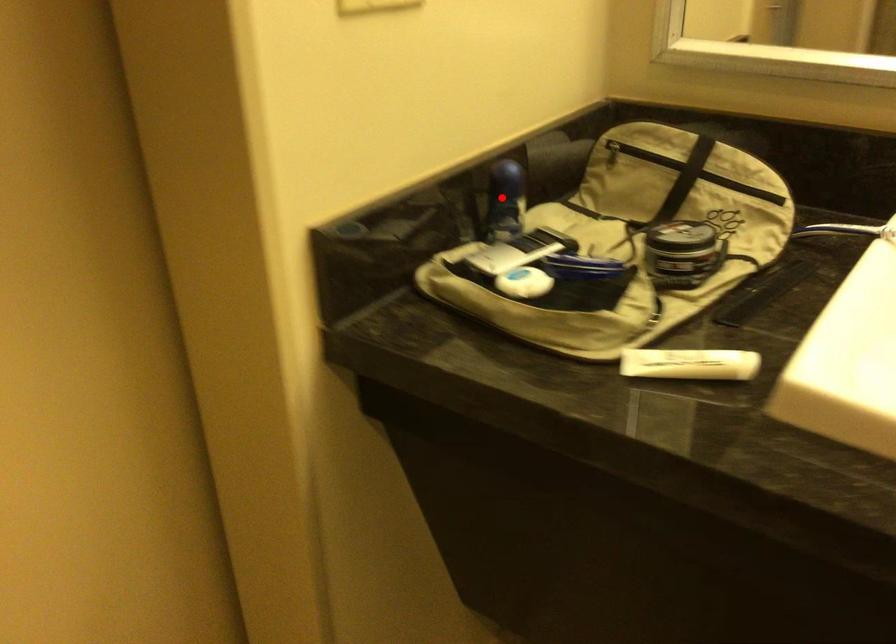
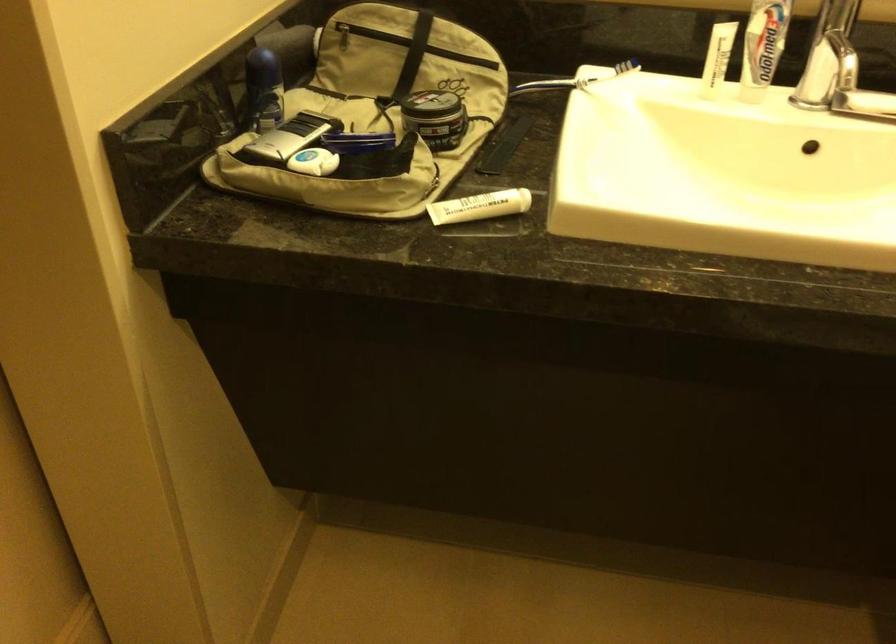
Locate, in the second image, the point that corresponds to the highlighted location in the first image.

(263, 88)